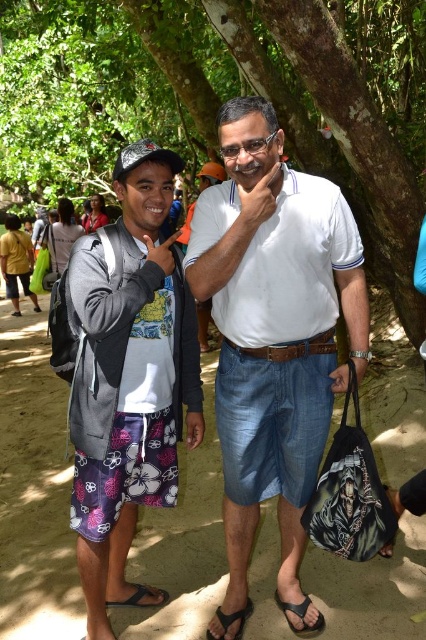
Question: Which point is farther to the camera?

Choices:
 (A) black synthetic sandal at lower center
 (B) gray fleece jacket at left
 (C) black rubber sandal at lower left

Answer: (C)

Question: Considering the relative positions of rough bark tree at center and black rubber sandal at lower left in the image provided, where is rough bark tree at center located with respect to black rubber sandal at lower left?

Choices:
 (A) left
 (B) right

Answer: (A)

Question: Which of these objects is positioned farthest from the gray fleece jacket at left?

Choices:
 (A) black synthetic sandal at lower center
 (B) white cotton shirt at center
 (C) black rubber sandal at lower left

Answer: (A)

Question: Among these objects, which one is nearest to the camera?

Choices:
 (A) rough bark tree at center
 (B) black synthetic sandal at lower center

Answer: (B)

Question: Is rough bark tree at center to the left of gray fleece jacket at left from the viewer's perspective?

Choices:
 (A) no
 (B) yes

Answer: (B)

Question: Does gray fleece jacket at left appear under black rubber sandal at lower left?

Choices:
 (A) yes
 (B) no

Answer: (B)